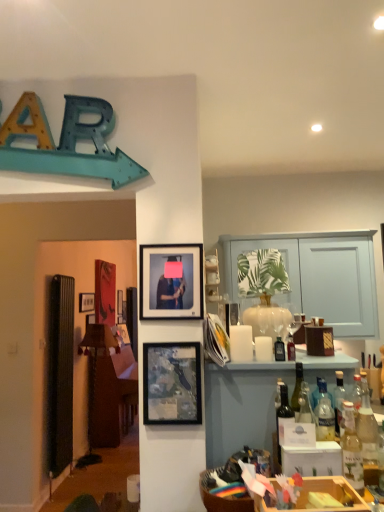
Question: Considering the positions of matte glass bottle at center, which is counted as the 1th bottle, starting from the back, and matte black picture frame at upper left, the third picture frame when ordered from right to left, in the image, is matte glass bottle at center, which is counted as the 1th bottle, starting from the back, taller or shorter than matte black picture frame at upper left, the third picture frame when ordered from right to left,?

Choices:
 (A) short
 (B) tall

Answer: (A)

Question: In terms of size, does matte glass bottle at center, which is counted as the fifth bottle, starting from the front, appear bigger or smaller than matte black picture frame at upper left, the 3th picture frame positioned from the front?

Choices:
 (A) small
 (B) big

Answer: (A)

Question: Estimate the real-world distances between objects in this image. Which object is farther from the translucent glass bottles at right?

Choices:
 (A) matte black frame at upper center, which is the 2th picture frame from back to front
 (B) wooden crate at lower right
 (C) transparent glass vase at center
 (D) translucent glass bottle at right, which is the 1th bottle from front to back
 (E) green glass wine bottle at center

Answer: (B)

Question: Based on their relative distances, which object is nearer to the wooden crate at lower right?

Choices:
 (A) translucent glass bottle at right, which appears as the 5th bottle when viewed from the back
 (B) translucent glass bottle at center-right, the 4th bottle positioned from the front
 (C) translucent glass bottle at right, the 2th bottle from the front
 (D) matte glass bottle at center, which is the second bottle from left to right
 (E) translucent glass bottles at right

Answer: (A)